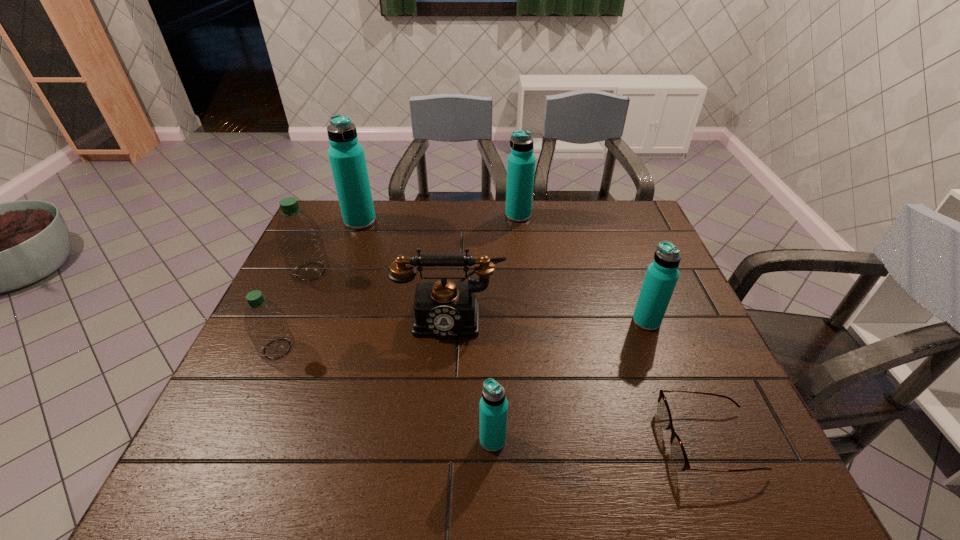
Locate an element on the screen. This screenshot has width=960, height=540. vacant point located on the front of the smaller green water bottle is located at coordinates (234, 448).

Locate an element on the screen. vacant area situated on the face of the spectacles is located at coordinates (493, 441).

Where is `vacant space located on the face of the spectacles`? vacant space located on the face of the spectacles is located at coordinates (587, 441).

This screenshot has width=960, height=540. What are the coordinates of `vacant space located 0.100m on the face of the spectacles` in the screenshot? It's located at (616, 441).

You are a GUI agent. You are given a task and a screenshot of the screen. Output one action in this format:
    pyautogui.click(x=<x>, y=<y>)
    Task: Click on the water bottle present at the near edge
    The image size is (960, 540).
    Given the screenshot: What is the action you would take?
    pyautogui.click(x=493, y=408)

I want to click on spectacles present at the near edge, so click(x=678, y=453).

Locate an element on the screen. water bottle that is positioned at the right edge is located at coordinates (662, 274).

Locate an element on the screen. The image size is (960, 540). spectacles at the right edge is located at coordinates (678, 453).

At what (x,y) coordinates should I click in order to perform the action: click on object positioned at the far left corner. Please return your answer as a coordinate pair (x, y). The width and height of the screenshot is (960, 540). Looking at the image, I should click on (346, 156).

You are a GUI agent. You are given a task and a screenshot of the screen. Output one action in this format:
    pyautogui.click(x=<x>, y=<y>)
    Task: Click on the object located in the near right corner section of the desktop
    The image size is (960, 540).
    Given the screenshot: What is the action you would take?
    pyautogui.click(x=678, y=453)